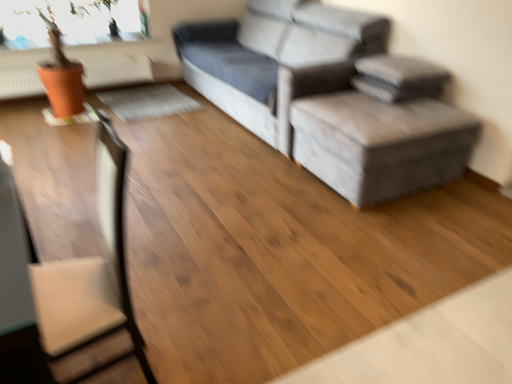
Find the location of a particular element. The height and width of the screenshot is (384, 512). empty space that is in between gray fabric ottoman at center and brown leather swivel chair at left is located at coordinates (271, 246).